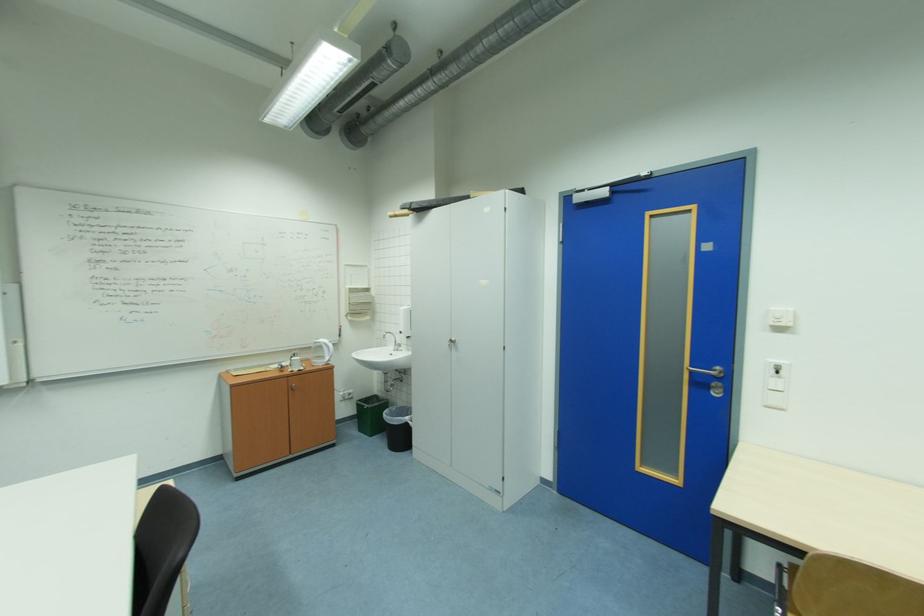
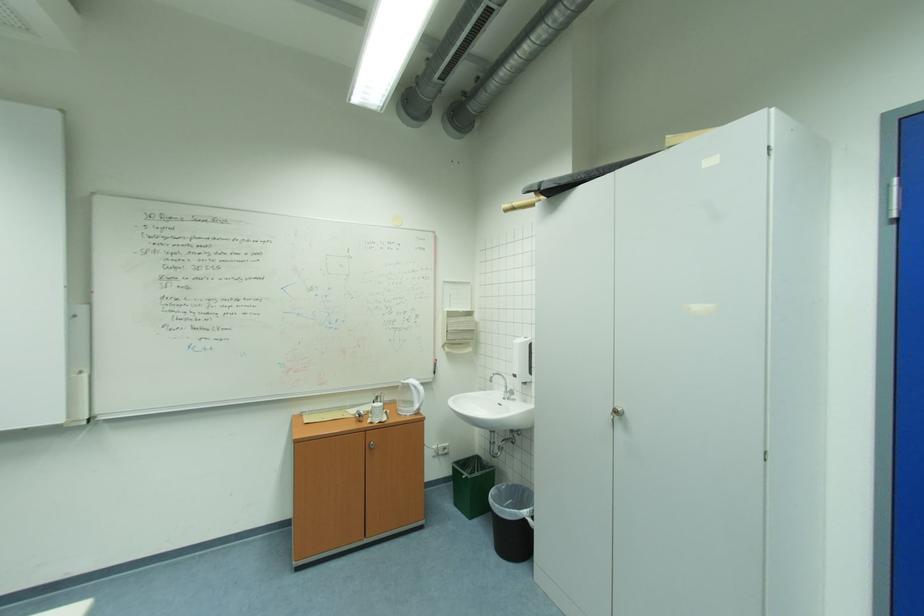
Question: The first image is from the beginning of the video and the second image is from the end. How did the camera likely rotate when shooting the video?

Choices:
 (A) Left
 (B) Right
 (C) Up
 (D) Down

Answer: (A)